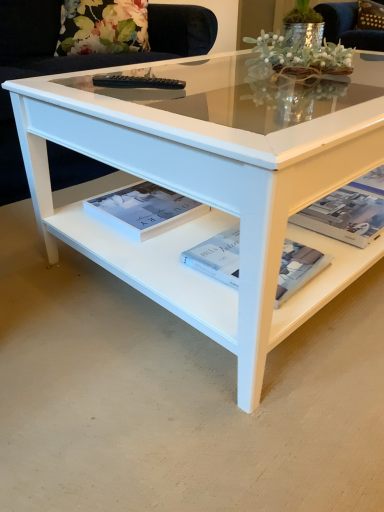
Question: Considering the relative sizes of white glossy book at center, the first magazine viewed from the left, and white paper magazine at center, which appears as the 2th magazine when viewed from the left, in the image provided, is white glossy book at center, the first magazine viewed from the left, taller than white paper magazine at center, which appears as the 2th magazine when viewed from the left,?

Choices:
 (A) no
 (B) yes

Answer: (B)

Question: Does white glossy book at center, the first magazine viewed from the left, appear on the right side of white paper magazine at center, which appears as the 2th magazine when viewed from the left?

Choices:
 (A) no
 (B) yes

Answer: (A)

Question: Is white paper magazine at center, which appears as the 2th magazine when viewed from the left, at the back of white glossy book at center, placed as the third magazine when sorted from right to left?

Choices:
 (A) yes
 (B) no

Answer: (B)

Question: Is white glossy book at center, placed as the third magazine when sorted from right to left, smaller than white paper magazine at center, acting as the second magazine starting from the right?

Choices:
 (A) no
 (B) yes

Answer: (A)

Question: From a real-world perspective, is white glossy book at center, the first magazine viewed from the left, physically above white paper magazine at center, acting as the second magazine starting from the right?

Choices:
 (A) no
 (B) yes

Answer: (B)

Question: From the image's perspective, relative to white paper magazine at center, which appears as the 2th magazine when viewed from the left, is white glossy coffee table at center above or below?

Choices:
 (A) above
 (B) below

Answer: (A)

Question: From their relative heights in the image, would you say white glossy coffee table at center is taller or shorter than white paper magazine at center, which appears as the 2th magazine when viewed from the left?

Choices:
 (A) short
 (B) tall

Answer: (B)

Question: From a real-world perspective, is white glossy coffee table at center above or below white paper magazine at center, which appears as the 2th magazine when viewed from the left?

Choices:
 (A) below
 (B) above

Answer: (B)

Question: Considering the positions of point (311, 143) and point (218, 243), is point (311, 143) closer or farther from the camera than point (218, 243)?

Choices:
 (A) closer
 (B) farther

Answer: (A)

Question: From the image's perspective, is white glossy magazine at lower right, which ranks as the 3th magazine in left-to-right order, positioned above or below white glossy book at center, placed as the third magazine when sorted from right to left?

Choices:
 (A) below
 (B) above

Answer: (A)

Question: From a real-world perspective, is white glossy magazine at lower right, the 1th magazine from the right, physically located above or below white glossy book at center, the first magazine viewed from the left?

Choices:
 (A) above
 (B) below

Answer: (B)

Question: Looking at their shapes, would you say white glossy magazine at lower right, which ranks as the 3th magazine in left-to-right order, is wider or thinner than white glossy book at center, the first magazine viewed from the left?

Choices:
 (A) thin
 (B) wide

Answer: (B)

Question: Considering the positions of white glossy magazine at lower right, the 1th magazine from the right, and white glossy book at center, placed as the third magazine when sorted from right to left, in the image, is white glossy magazine at lower right, the 1th magazine from the right, taller or shorter than white glossy book at center, placed as the third magazine when sorted from right to left,?

Choices:
 (A) tall
 (B) short

Answer: (B)

Question: From a real-world perspective, relative to white paper magazine at center, which appears as the 2th magazine when viewed from the left, is brown fabric pillow at upper right vertically above or below?

Choices:
 (A) above
 (B) below

Answer: (A)

Question: Is brown fabric pillow at upper right wider or thinner than white paper magazine at center, acting as the second magazine starting from the right?

Choices:
 (A) thin
 (B) wide

Answer: (A)